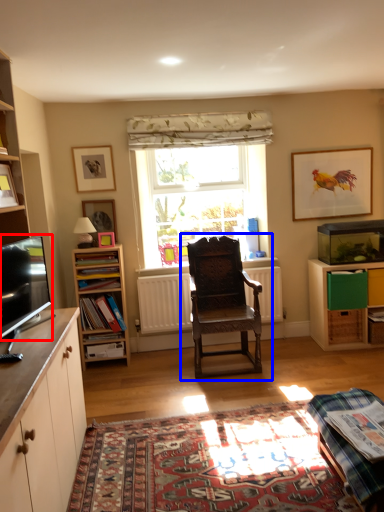
Question: Among these objects, which one is nearest to the camera, television (highlighted by a red box) or chair (highlighted by a blue box)?

Choices:
 (A) television
 (B) chair

Answer: (A)